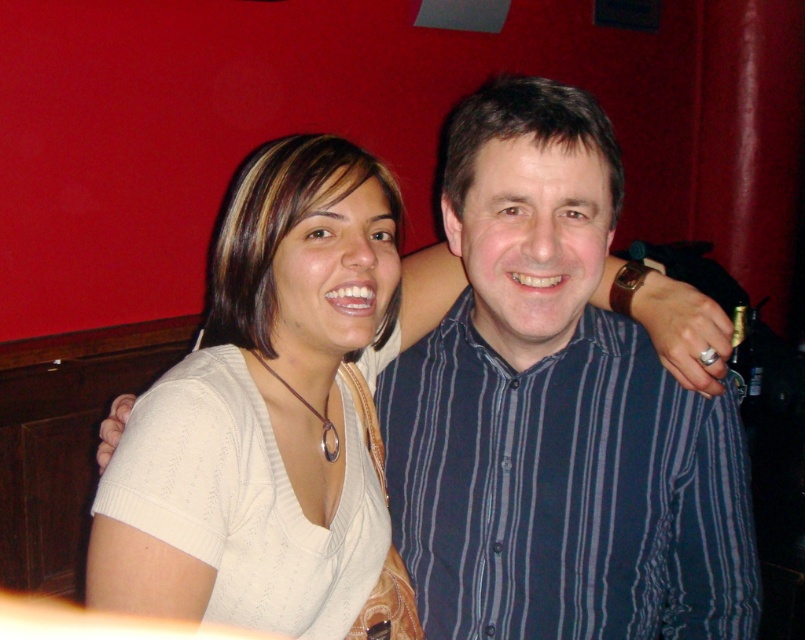
You are organizing a clothing donation drive and need to categorize items based on their size. You see two white items in the image, the white fabric shirt at center and the white knitwear at center. Which one should you place in the large size bin?

The white fabric shirt at center has a larger size compared to the white knitwear at center, so the white fabric shirt at center should be placed in the large size bin.

Consider the image. You are organizing a clothing donation drive and need to categorize shirts by size. You have two shirts in front of you, the blue striped shirt at center and the white fabric shirt at center. Which shirt should you place in the small size bin?

The blue striped shirt at center has a smaller size compared to white fabric shirt at center, so it should be placed in the small size bin.

You are a photographer at a social event and need to adjust the lighting to ensure both the white fabric shirt at center and the white knitwear at center are visible. Since they are both white, how can you tell them apart based on their appearance?

The white fabric shirt at center is wider than the white knitwear at center, so the shirt would appear broader in width compared to the knitwear.